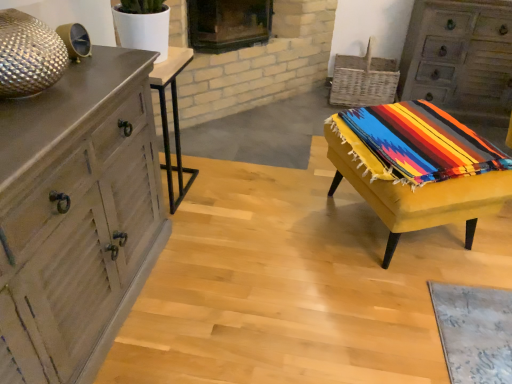
Question: Could you tell me if yellow fabric-covered stool at right, which is the 2th table from left to right, is turned towards wooden chest of drawers at left, marked as the 1th chest of drawers in a left-to-right arrangement?

Choices:
 (A) yes
 (B) no

Answer: (B)

Question: Is yellow fabric-covered stool at right, which is the 2th table from left to right, with wooden chest of drawers at left, which is counted as the 2th chest of drawers, starting from the back?

Choices:
 (A) yes
 (B) no

Answer: (B)

Question: Can you confirm if yellow fabric-covered stool at right, which is the 2th table from left to right, is smaller than wooden chest of drawers at left, the second chest of drawers in the top-to-bottom sequence?

Choices:
 (A) yes
 (B) no

Answer: (A)

Question: Is yellow fabric-covered stool at right, which is the 2th table from left to right, taller than wooden chest of drawers at left, marked as the 1th chest of drawers in a left-to-right arrangement?

Choices:
 (A) yes
 (B) no

Answer: (B)

Question: Would you say yellow fabric-covered stool at right, acting as the 1th table starting from the right, is outside wooden chest of drawers at left, which is counted as the 2th chest of drawers, starting from the back?

Choices:
 (A) yes
 (B) no

Answer: (A)

Question: In terms of height, does rustic wood chest of drawers at upper right, which appears as the first chest of drawers when viewed from the right, look taller or shorter compared to yellow fabric-covered stool at right, acting as the 1th table starting from the right?

Choices:
 (A) tall
 (B) short

Answer: (A)

Question: Is point (409, 82) closer or farther from the camera than point (441, 117)?

Choices:
 (A) farther
 (B) closer

Answer: (A)

Question: Which is correct: rustic wood chest of drawers at upper right, the first chest of drawers when ordered from top to bottom, is inside yellow fabric-covered stool at right, acting as the 1th table starting from the right, or outside of it?

Choices:
 (A) inside
 (B) outside

Answer: (B)

Question: From a real-world perspective, is rustic wood chest of drawers at upper right, placed as the 2th chest of drawers when sorted from left to right, above or below yellow fabric-covered stool at right, acting as the 1th table starting from the right?

Choices:
 (A) below
 (B) above

Answer: (B)

Question: Relative to rustic wood chest of drawers at upper right, which appears as the first chest of drawers when viewed from the right, is black glass fireplace at upper center in front or behind?

Choices:
 (A) behind
 (B) front

Answer: (B)

Question: Considering the positions of black glass fireplace at upper center and rustic wood chest of drawers at upper right, the second chest of drawers when ordered from front to back, in the image, is black glass fireplace at upper center wider or thinner than rustic wood chest of drawers at upper right, the second chest of drawers when ordered from front to back,?

Choices:
 (A) thin
 (B) wide

Answer: (A)

Question: In terms of height, does black glass fireplace at upper center look taller or shorter compared to rustic wood chest of drawers at upper right, the second chest of drawers when ordered from front to back?

Choices:
 (A) short
 (B) tall

Answer: (A)

Question: From the image's perspective, is black glass fireplace at upper center above or below rustic wood chest of drawers at upper right, placed as the 2th chest of drawers when sorted from left to right?

Choices:
 (A) below
 (B) above

Answer: (B)

Question: Is black glass fireplace at upper center in front of or behind wooden chest of drawers at left, placed as the 1th chest of drawers when sorted from front to back, in the image?

Choices:
 (A) behind
 (B) front

Answer: (A)

Question: From a real-world perspective, relative to wooden chest of drawers at left, the second chest of drawers in the top-to-bottom sequence, is black glass fireplace at upper center vertically above or below?

Choices:
 (A) above
 (B) below

Answer: (A)